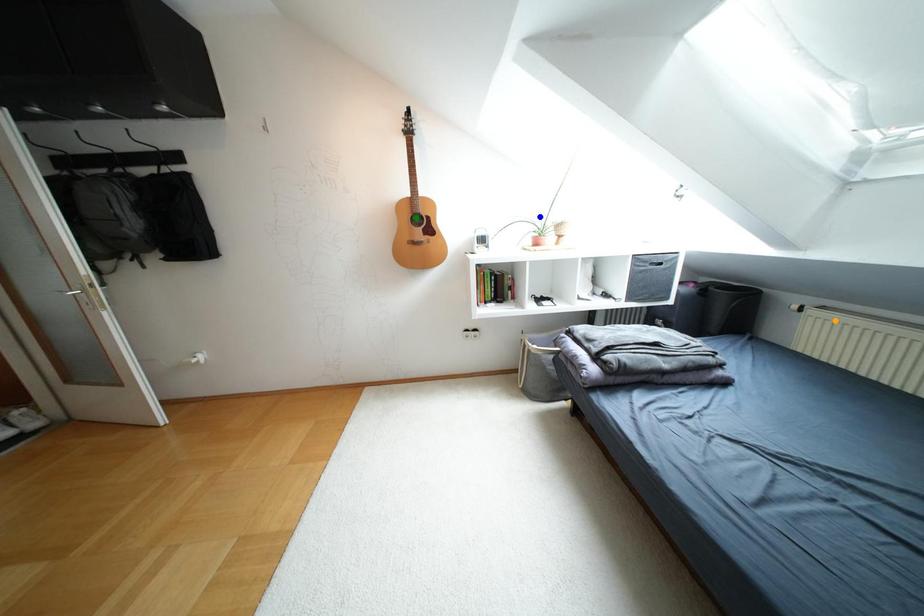
Order these from nearest to farthest:
green point | blue point | orange point

orange point, green point, blue point